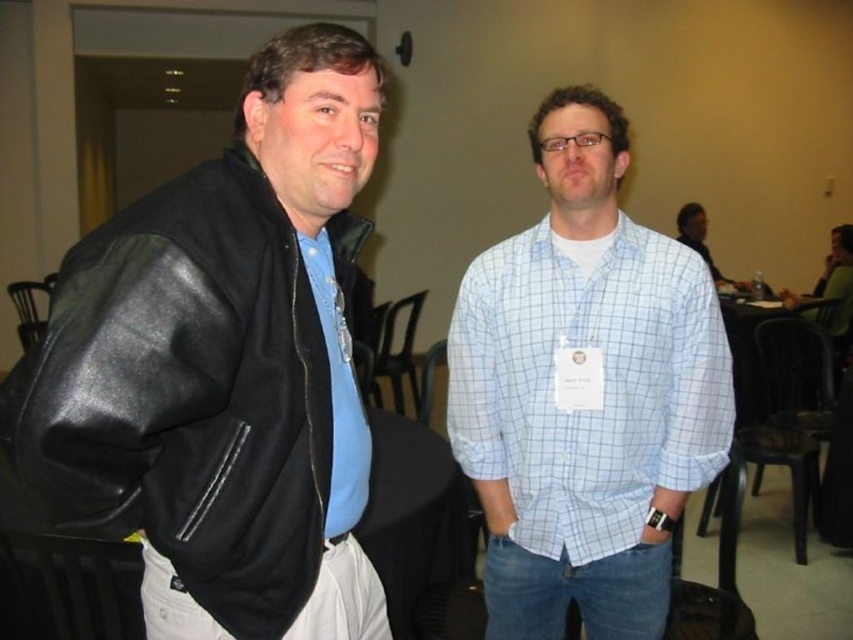
You are organizing a photo shoot and need to place a backdrop behind both the black leather jacket at left and the light blue checkered shirt at center. The backdrop is 2 meters wide. Can the backdrop accommodate both objects given their sizes?

The black leather jacket at left has a smaller size compared to light blue checkered shirt at center. Since the backdrop is 2 meters wide, it can easily accommodate both objects as their combined size is likely less than the backdrop width.

You are organizing a photo shoot and need to ensure that the black leather jacket at left does not cover the light blue checkered shirt at center in the final image. Based on their positions, can you adjust the camera angle to achieve this?

The black leather jacket at left is positioned over the light blue checkered shirt at center, so adjusting the camera angle to shoot from below or the side might help avoid covering the shirt.

You are organizing a coat rack for a conference and have two items to hang. The black leather jacket at left and the light blue checkered shirt at center. Which item can be hung on a narrower hanger without needing adjustments?

The black leather jacket at left can be hung on a narrower hanger without needing adjustments because it is thinner than the light blue checkered shirt at center.